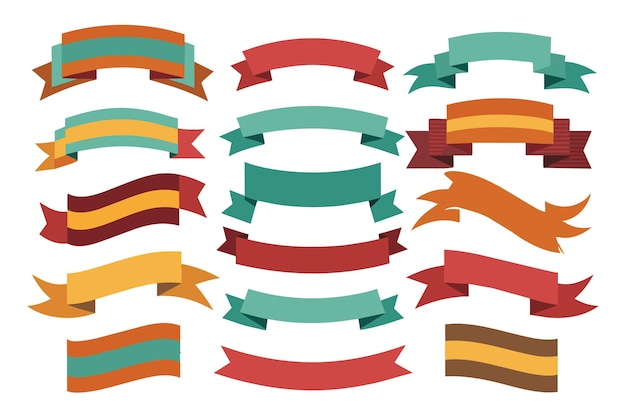
Image resolution: width=626 pixels, height=417 pixels. Find the location of `middle column`. middle column is located at coordinates (310, 55), (314, 117), (308, 183), (308, 254), (308, 308), (302, 371).